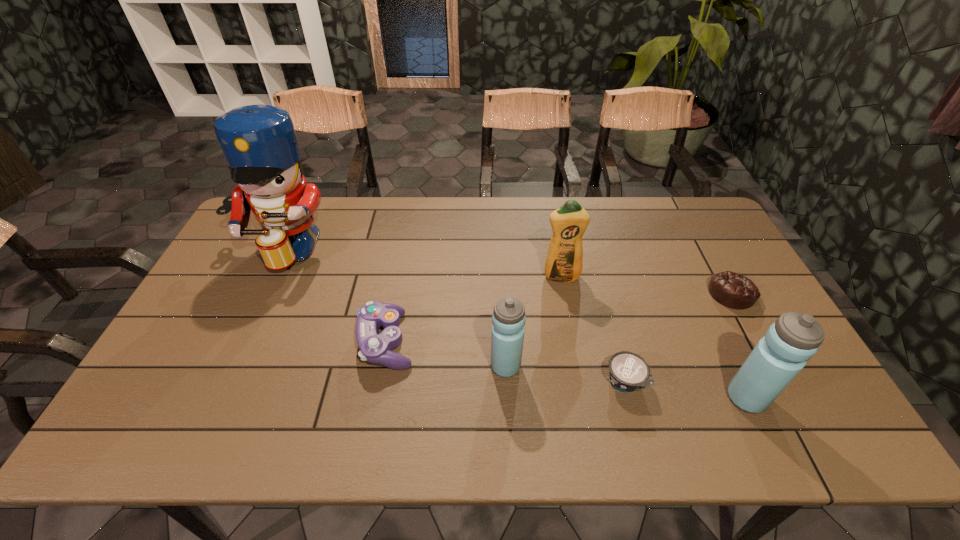
Locate an element on the screen. yogurt present at the near edge is located at coordinates (628, 372).

This screenshot has width=960, height=540. I want to click on object that is at the left edge, so click(259, 142).

Identify the location of water bottle at the right edge. The image size is (960, 540). (793, 339).

Find the location of `beanbag present at the right edge`. beanbag present at the right edge is located at coordinates (732, 290).

You are a GUI agent. You are given a task and a screenshot of the screen. Output one action in this format:
    pyautogui.click(x=<x>, y=<y>)
    Task: Click on the object located at the far left corner
    
    Given the screenshot: What is the action you would take?
    pyautogui.click(x=259, y=142)

I want to click on object that is at the near right corner, so click(793, 339).

Where is `blank space at the far edge`? The image size is (960, 540). blank space at the far edge is located at coordinates (451, 211).

In the image, there is a desktop. Identify the location of vacant space at the near edge. (212, 396).

In the image, there is a desktop. Where is `vacant space at the left edge`? vacant space at the left edge is located at coordinates (226, 337).

The height and width of the screenshot is (540, 960). In the image, there is a desktop. Find the location of `vacant space at the right edge`. vacant space at the right edge is located at coordinates (753, 308).